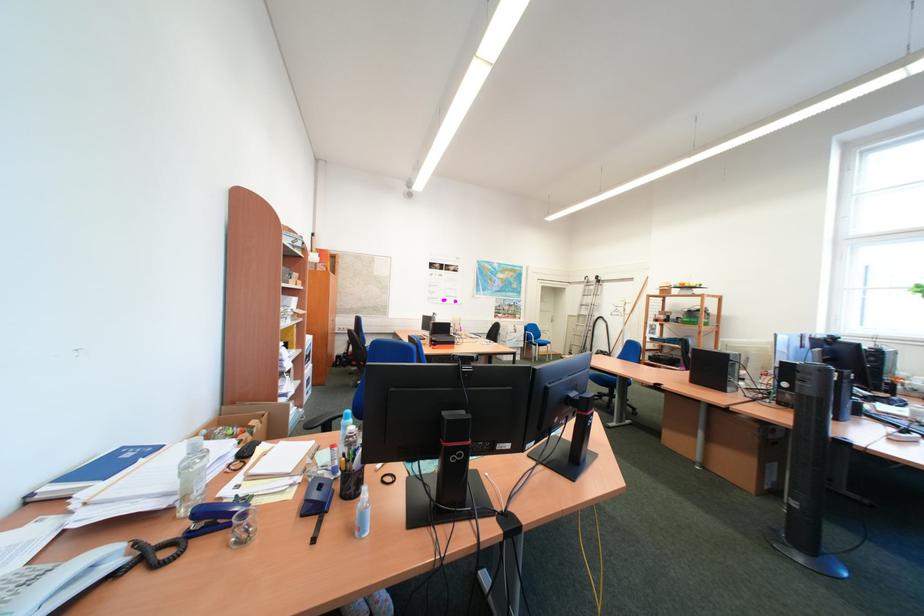
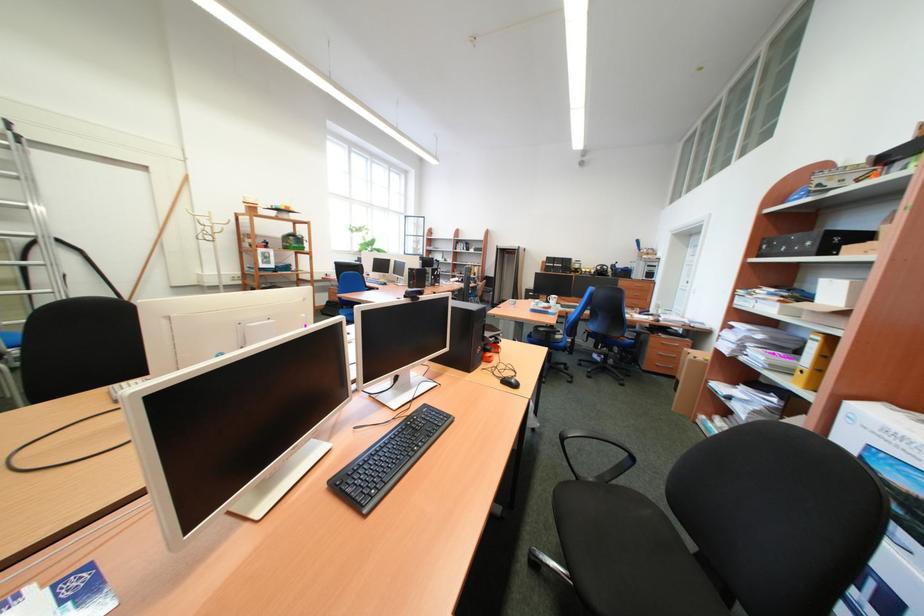
Question: I am providing you with two images of the same scene from different viewpoints. Which of the following objects are not visible in image2?

Choices:
 (A) plastic water bottle
 (B) white mug handle
 (C) purple step stool
 (D) yellow file binder

Answer: (A)